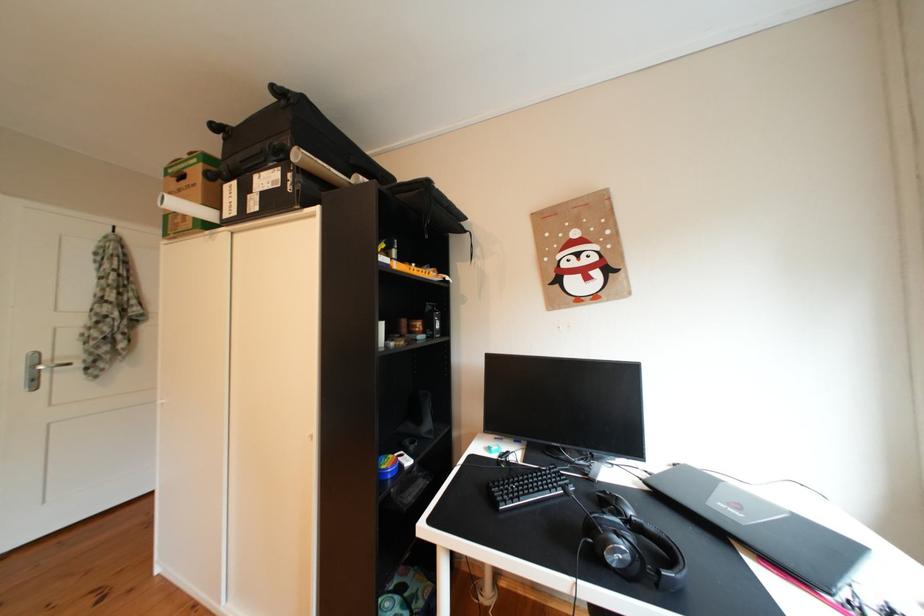
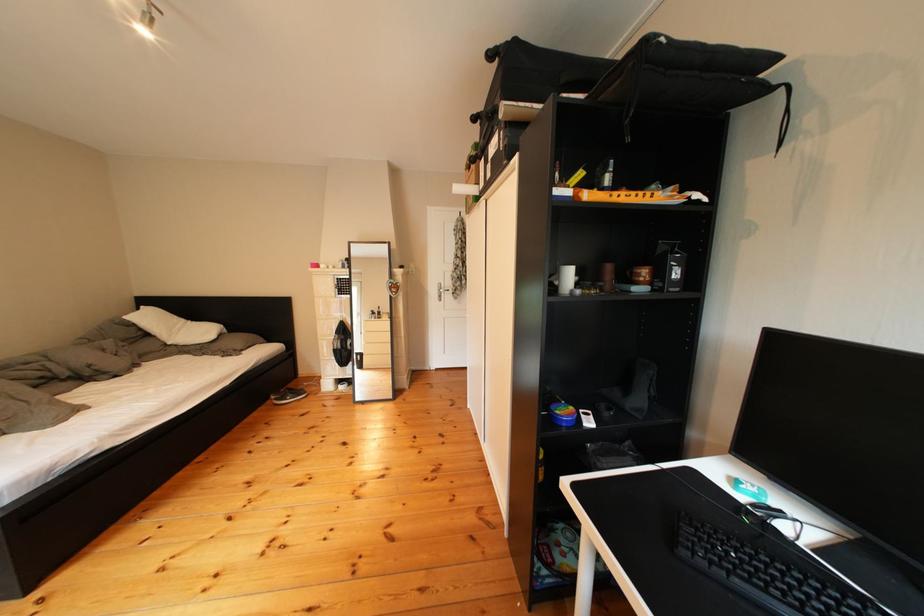
In the second image, find the point that corresponds to the point at 480,233 in the first image.

(789, 87)